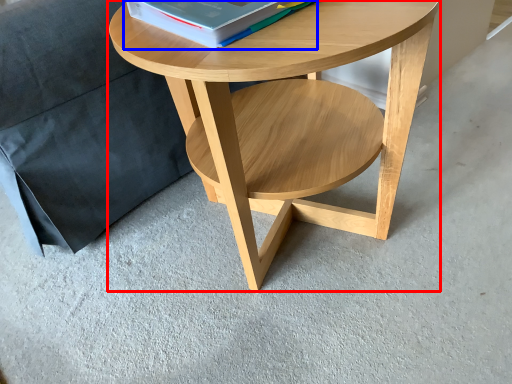
Question: Which object appears closest to the camera in this image, coffee table (highlighted by a red box) or paperback book (highlighted by a blue box)?

Choices:
 (A) coffee table
 (B) paperback book

Answer: (A)